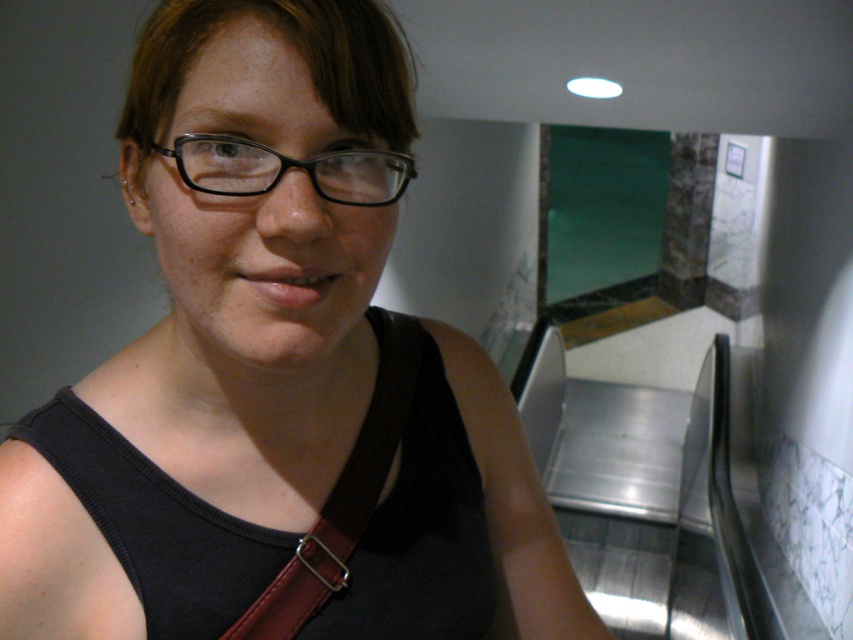
Is point (450, 588) closer to viewer compared to point (262, 182)?

That is False.

Who is more distant from viewer, (302, 396) or (225, 173)?

The point (302, 396) is behind.

Who is more forward, [347,420] or [276,180]?

Point [276,180] is in front.

The image size is (853, 640). What are the coordinates of `black fabric tank top at center` in the screenshot? It's located at (277, 378).

Is point (354, 282) in front of point (316, 532)?

That is True.

How much distance is there between black fabric tank top at center and brown leather strap at center?

They are 10.80 centimeters apart.

Based on the photo, who is more distant from viewer, (198, 202) or (317, 582)?

The point (317, 582) is behind.

At what (x,y) coordinates should I click in order to perform the action: click on black fabric tank top at center. Please return your answer as a coordinate pair (x, y). Looking at the image, I should click on (277, 378).

Is the position of brown leather strap at center less distant than that of black plastic glasses at upper center?

That is False.

Does brown leather strap at center have a lesser height compared to black plastic glasses at upper center?

Incorrect, brown leather strap at center's height does not fall short of black plastic glasses at upper center's.

This screenshot has height=640, width=853. Describe the element at coordinates (343, 497) in the screenshot. I see `brown leather strap at center` at that location.

Where is `brown leather strap at center`? The height and width of the screenshot is (640, 853). brown leather strap at center is located at coordinates (343, 497).